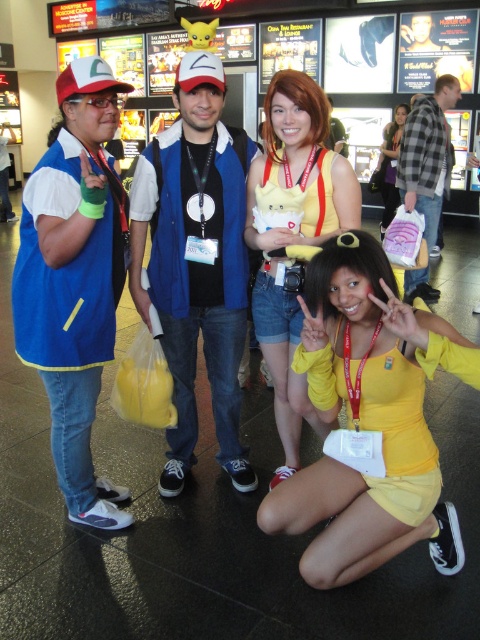
Can you confirm if matte blue vest at center is bigger than yellow fabric dress at center?

No.

From the picture: Who is lower down, matte blue vest at center or yellow fabric dress at center?

Positioned lower is yellow fabric dress at center.

Locate an element on the screen. matte blue vest at center is located at coordinates (195, 262).

Identify the location of matte blue vest at center. (195, 262).

Can you confirm if yellow fabric dress at center is positioned below yellow fabric dress at lower center?

Correct, yellow fabric dress at center is located below yellow fabric dress at lower center.

Is point (313, 228) positioned behind point (389, 193)?

No.

Is point (321, 189) in front of point (408, 112)?

Yes, point (321, 189) is closer to viewer.

What are the coordinates of `yellow fabric dress at center` in the screenshot? It's located at (301, 164).

Does yellow fabric dress at center have a lesser width compared to plaid flannel shirt at upper right?

Yes.

Does yellow fabric dress at center appear over plaid flannel shirt at upper right?

No, yellow fabric dress at center is not above plaid flannel shirt at upper right.

Does point (266, 163) lie behind point (420, 141)?

No.

Image resolution: width=480 pixels, height=640 pixels. What are the coordinates of `yellow fabric dress at center` in the screenshot? It's located at (301, 164).